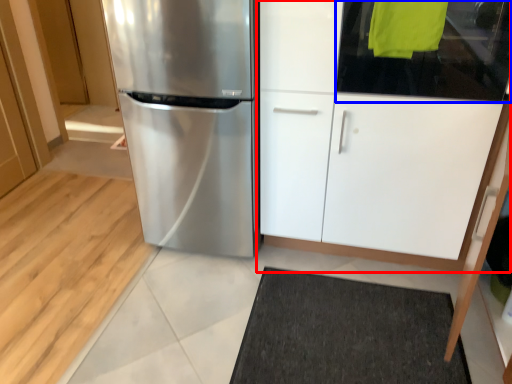
Question: Which of the following is the closest to the observer, cabinetry (highlighted by a red box) or glass door (highlighted by a blue box)?

Choices:
 (A) cabinetry
 (B) glass door

Answer: (A)